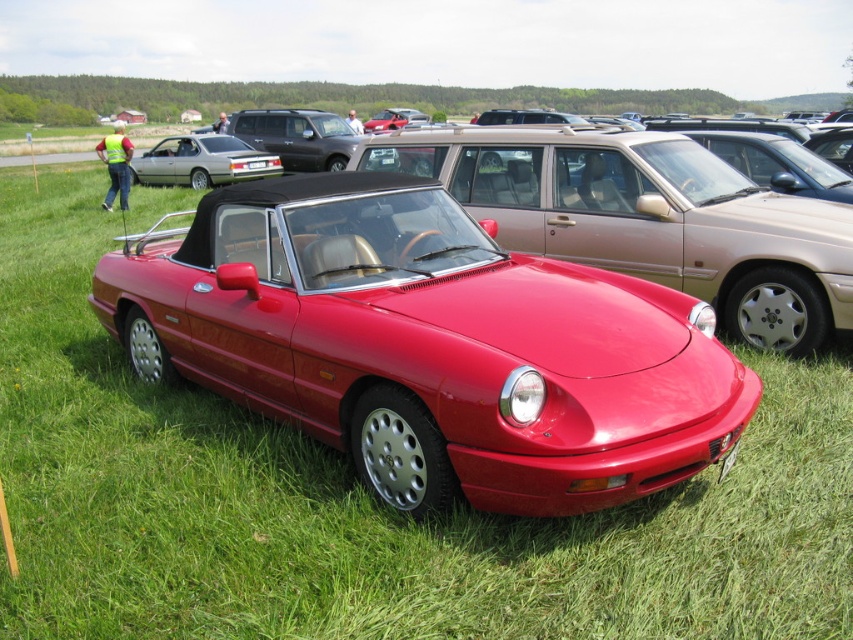
You are a photographer trying to capture the glossy red convertible at center and the white plastic license plate at center in the same frame. Based on their positions, which object should you focus on first to ensure both are in focus?

The glossy red convertible at center is below the white plastic license plate at center. To ensure both are in focus, you should focus on the white plastic license plate at center first since it is closer to the camera.

Looking at this image, you are a photographer trying to capture the glossy red convertible at center and the shiny red convertible at center. According to the scene, which one is positioned lower in the image?

The glossy red convertible at center is positioned lower than the shiny red convertible at center in the image.

You are a photographer trying to capture the silver metallic sedan at center and the white plastic license plate at center in the same frame. Which object is located to the left of the other?

The silver metallic sedan at center is positioned on the left side of white plastic license plate at center.